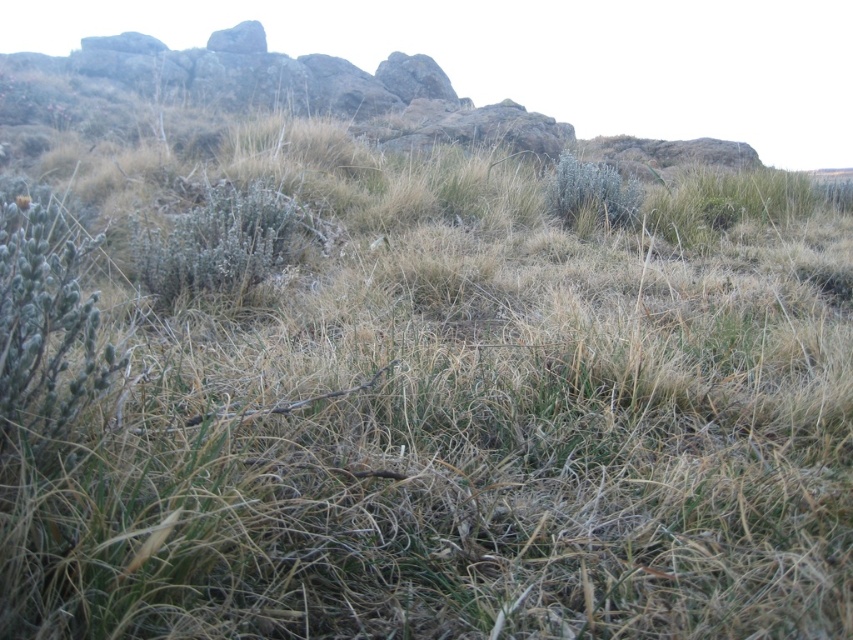
You are standing at the origin point in the image. Where is the fuzzy gray bush at center located in 2D coordinates?

The fuzzy gray bush at center is located at 2D coordinates point (223, 241).